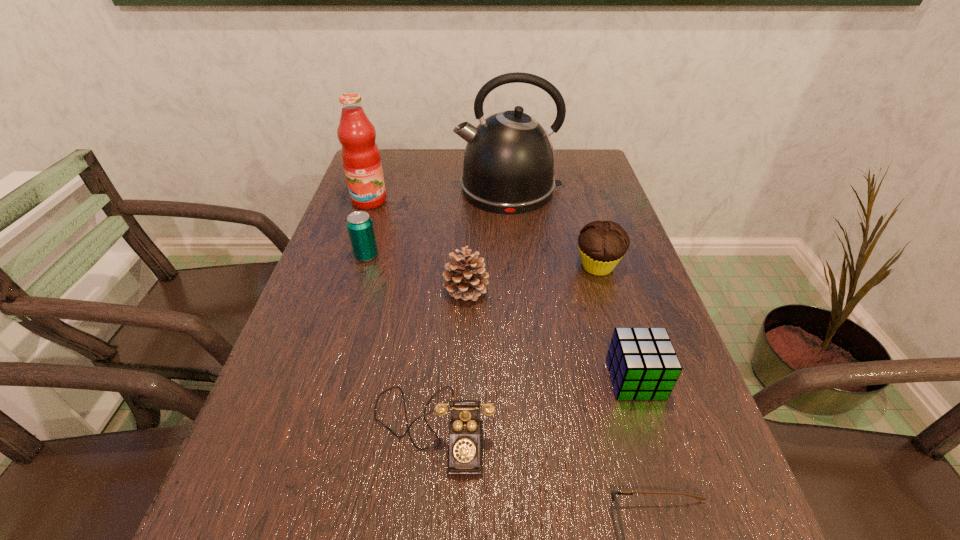
I want to click on kettle, so click(x=509, y=162).

At what (x,y) coordinates should I click in order to perform the action: click on fruit juice. Please return your answer as a coordinate pair (x, y). Looking at the image, I should click on (360, 154).

At what (x,y) coordinates should I click in order to perform the action: click on beer can. Please return your answer as a coordinate pair (x, y). Image resolution: width=960 pixels, height=540 pixels. Looking at the image, I should click on (360, 228).

Image resolution: width=960 pixels, height=540 pixels. I want to click on muffin, so click(602, 244).

Locate an element on the screen. pinecone is located at coordinates (466, 278).

At what (x,y) coordinates should I click in order to perform the action: click on telephone. Please return your answer as a coordinate pair (x, y). Looking at the image, I should click on (465, 448).

Identify the location of cube. This screenshot has width=960, height=540. (642, 362).

Where is `vacant region located on the spout of the kettle`? vacant region located on the spout of the kettle is located at coordinates (435, 189).

The width and height of the screenshot is (960, 540). I want to click on vacant space located 0.300m on the spout of the kettle, so click(x=354, y=189).

In order to click on free space located on the spout of the kettle in this screenshot , I will do `click(378, 189)`.